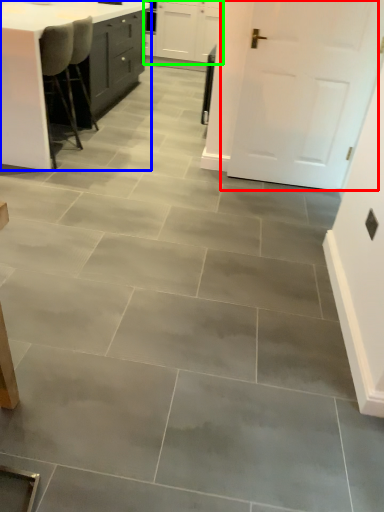
Question: Which is farther away from door (highlighted by a red box)? table (highlighted by a blue box) or cabinetry (highlighted by a green box)?

Choices:
 (A) table
 (B) cabinetry

Answer: (B)